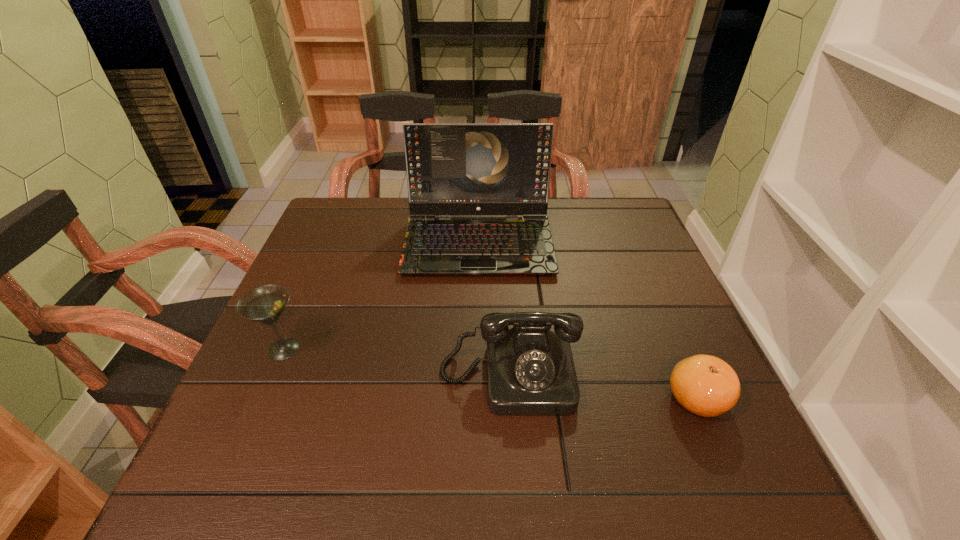
Identify the location of vacant area in the image that satisfies the following two spatial constraints: 1. on the screen of the tallest object; 2. on the left side of the rightmost object. (478, 399).

Where is `vacant space that satisfies the following two spatial constraints: 1. on the dial of the clementine; 2. on the left side of the telephone`? vacant space that satisfies the following two spatial constraints: 1. on the dial of the clementine; 2. on the left side of the telephone is located at coordinates (511, 399).